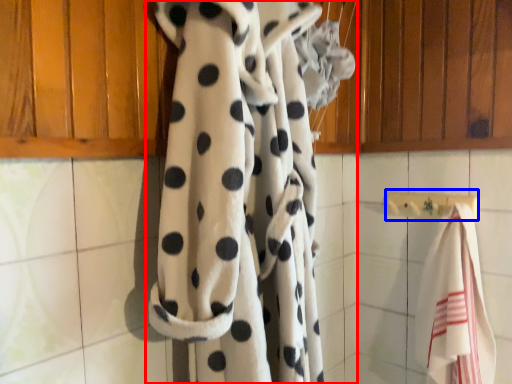
Question: Which point is closer to the camera, curtain (highlighted by a red box) or towel bar (highlighted by a blue box)?

Choices:
 (A) curtain
 (B) towel bar

Answer: (A)